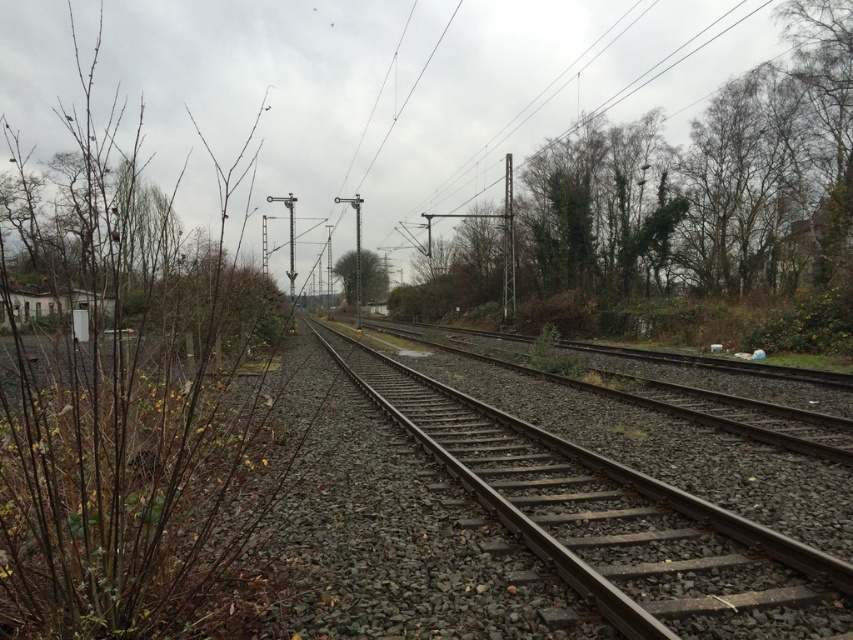
You are standing at the center of the image and want to walk towards the green leafy tree at center. Which direction should you move to get closer to it without crossing the metal train track at center?

You should move to the side, either left or right, to avoid the metal train track at center and walk towards the green leafy tree at center since the track is closer to you than the tree.

You are a painter standing at the edge of the railway tracks. You need to paint both the brown woody branches at left and the green leafy tree at center. Which object should you paint first to maintain perspective, considering their sizes?

You should paint the green leafy tree at center first because it is smaller and closer to the horizon, while the brown woody branches at left are larger and likely closer to you, following the perspective rule that smaller objects appear farther away.